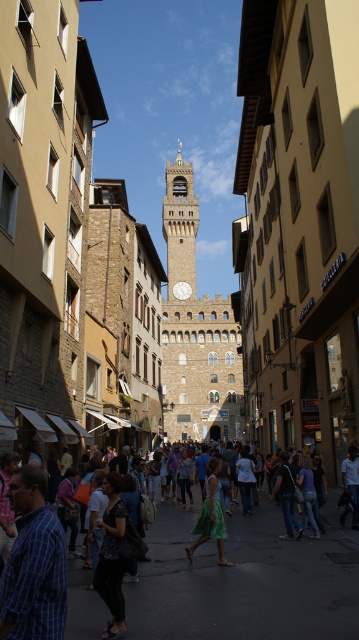
You are standing on the bustling street in Florence and want to take a photo that includes both the point at coordinates (204, 627) and the point at coordinates (196, 522). Which point should you focus on first to ensure both are in clear view?

You should focus on point (204, 627) first because it is closer to the camera than point (196, 522), ensuring both points are in focus when using depth of field.